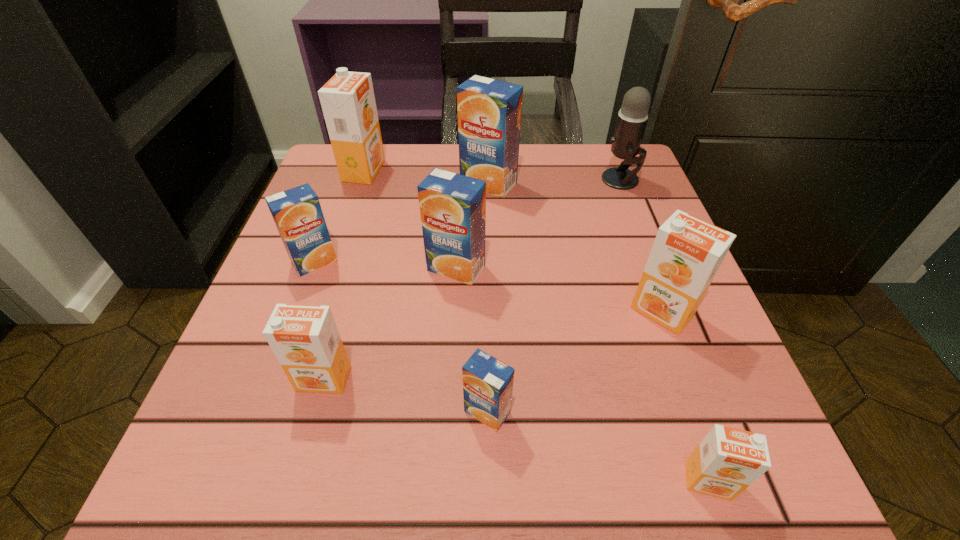
Identify which object is located as the fourth nearest to the farthest blue orange_juice. Please provide its 2D coordinates. Your answer should be formatted as a tuple, i.e. [(x, y)], where the tuple contains the x and y coordinates of a point satisfying the conditions above.

[(297, 213)]

What are the coordinates of `orange juice that is the third closest to the farthest orange orange juice` in the screenshot? It's located at (x=452, y=206).

Identify the location of orange juice that is the fifth nearest to the third nearest orange orange juice. The height and width of the screenshot is (540, 960). click(x=304, y=338).

Locate which blue orange_juice ranks third in proximity to the nearest orange juice. Please provide its 2D coordinates. Your answer should be formatted as a tuple, i.e. [(x, y)], where the tuple contains the x and y coordinates of a point satisfying the conditions above.

[(489, 111)]

Locate an element on the screen. The image size is (960, 540). blue orange_juice identified as the closest to the second biggest blue orange_juice is located at coordinates (297, 213).

This screenshot has height=540, width=960. What are the coordinates of `the third closest orange orange juice to the farthest blue orange_juice` in the screenshot? It's located at (304, 338).

The height and width of the screenshot is (540, 960). Find the location of `orange orange juice identified as the third closest to the farthest blue orange_juice`. orange orange juice identified as the third closest to the farthest blue orange_juice is located at coordinates (304, 338).